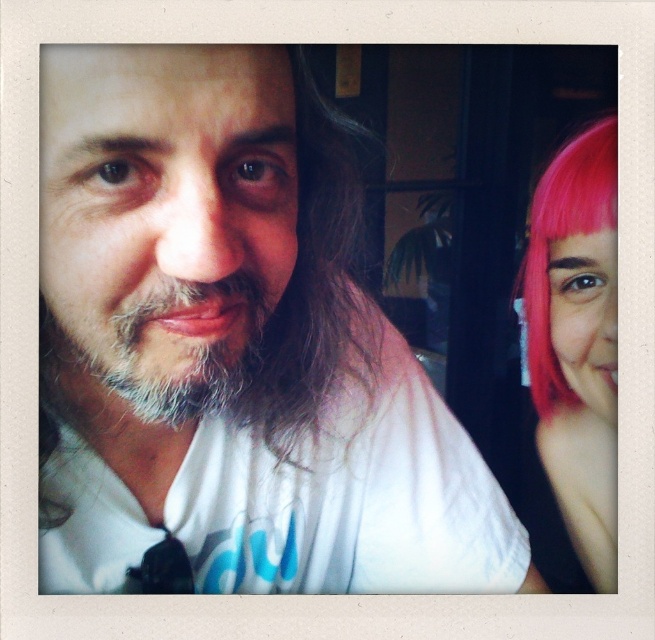
Question: Among these objects, which one is nearest to the camera?

Choices:
 (A) pink hair at right
 (B) white matte shirt at center
 (C) graysoftbeard at center

Answer: (B)

Question: Does white matte shirt at center appear under graysoftbeard at center?

Choices:
 (A) no
 (B) yes

Answer: (B)

Question: Which object is positioned farthest from the pink hair at right?

Choices:
 (A) graysoftbeard at center
 (B) white matte shirt at center

Answer: (A)

Question: Which point appears closest to the camera in this image?

Choices:
 (A) (105, 358)
 (B) (552, 188)

Answer: (A)

Question: Is white matte shirt at center further to camera compared to graysoftbeard at center?

Choices:
 (A) no
 (B) yes

Answer: (A)

Question: Does pink hair at right lie in front of graysoftbeard at center?

Choices:
 (A) yes
 (B) no

Answer: (B)